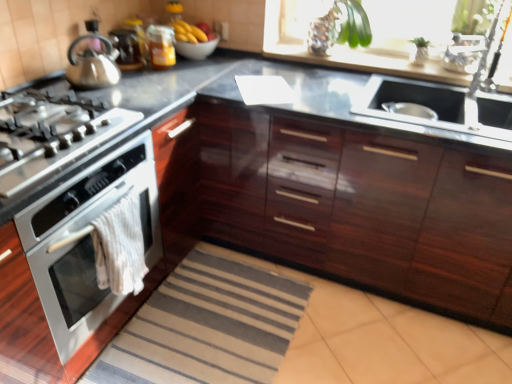
Based on the photo, in order to face satin steel sink at center right, should I rotate leftwards or rightwards?

To face it directly, rotate right by 23.211 degrees.

What do you see at coordinates (126, 49) in the screenshot? I see `metallic silver kettle at upper left` at bounding box center [126, 49].

In order to face satin nickel faucet at upper right, should I rotate leftwards or rightwards?

To align with it, rotate right about 27.748°.

This screenshot has height=384, width=512. I want to click on yellow matte bananas at upper center, so click(x=188, y=32).

Locate an element on the screen. This screenshot has height=384, width=512. satin steel sink at center right is located at coordinates (438, 107).

I want to click on material lying below the shiny metallic kettle at upper left (from the image's perspective), so click(120, 247).

Is white towel at lower left oriented towards shiny metallic kettle at upper left?

No, white towel at lower left is not oriented towards shiny metallic kettle at upper left.

From the image's perspective, is white towel at lower left positioned above or below shiny metallic kettle at upper left?

From the image's perspective, white towel at lower left appears below shiny metallic kettle at upper left.

Does white towel at lower left appear on the right side of shiny metallic kettle at upper left?

Yes, white towel at lower left is to the right of shiny metallic kettle at upper left.

How different are the orientations of satin steel sink at center right and shiny metallic kettle at upper left in degrees?

68.8 degrees.

Looking at this image, from the image's perspective, who appears lower, satin steel sink at center right or shiny metallic kettle at upper left?

satin steel sink at center right appears lower in the image.

Is the surface of satin steel sink at center right in direct contact with shiny metallic kettle at upper left?

No, satin steel sink at center right is not in contact with shiny metallic kettle at upper left.

In the scene shown: Is shiny metallic kettle at upper left inside satin steel sink at center right?

No, shiny metallic kettle at upper left is located outside of satin steel sink at center right.

Choose the correct answer: Is white towel at lower left inside satin silver gas stove at left or outside it?

white towel at lower left is spatially situated outside satin silver gas stove at left.

Is white towel at lower left placed right next to satin silver gas stove at left?

No, white towel at lower left is not beside satin silver gas stove at left.

Considering the relative sizes of white towel at lower left and satin silver gas stove at left in the image provided, is white towel at lower left smaller than satin silver gas stove at left?

Indeed, white towel at lower left has a smaller size compared to satin silver gas stove at left.

In the image, is satin silver gas stove at left on the left side or the right side of shiny metallic kettle at upper left?

In the image, satin silver gas stove at left appears on the left side of shiny metallic kettle at upper left.

Is satin silver gas stove at left turned away from shiny metallic kettle at upper left?

No, satin silver gas stove at left's orientation is not away from shiny metallic kettle at upper left.

From the image's perspective, which is above, satin silver gas stove at left or shiny metallic kettle at upper left?

shiny metallic kettle at upper left appears higher in the image.

Can you tell me how much satin silver gas stove at left and shiny metallic kettle at upper left differ in facing direction?

There is a 21.2-degree angle between the facing directions of satin silver gas stove at left and shiny metallic kettle at upper left.

From a real-world perspective, is shiny metallic kettle at upper left above or below metallic silver kettle at upper left?

shiny metallic kettle at upper left is above metallic silver kettle at upper left.

Can you tell me how much shiny metallic kettle at upper left and metallic silver kettle at upper left differ in facing direction?

The angular difference between shiny metallic kettle at upper left and metallic silver kettle at upper left is 28.7 degrees.

Where is `kitchen appliance located in front of the metallic silver kettle at upper left`? kitchen appliance located in front of the metallic silver kettle at upper left is located at coordinates (92, 65).

Could you tell me if yellow matte bananas at upper center is facing shiny metallic kettle at upper left?

No, yellow matte bananas at upper center is not aimed at shiny metallic kettle at upper left.

Consider the image. Which is more to the left, yellow matte bananas at upper center or shiny metallic kettle at upper left?

shiny metallic kettle at upper left.

Considering the relative positions of yellow matte bananas at upper center and shiny metallic kettle at upper left in the image provided, is yellow matte bananas at upper center in front of shiny metallic kettle at upper left?

No, yellow matte bananas at upper center is further to the viewer.

Where is `fruit to the right of shiny metallic kettle at upper left`? This screenshot has height=384, width=512. fruit to the right of shiny metallic kettle at upper left is located at coordinates (188, 32).

Can you confirm if glossy wood cabinetry at center is wider than shiny metallic kettle at upper left?

Correct, the width of glossy wood cabinetry at center exceeds that of shiny metallic kettle at upper left.

Is there a large distance between glossy wood cabinetry at center and shiny metallic kettle at upper left?

glossy wood cabinetry at center is near shiny metallic kettle at upper left, not far away.

From the image's perspective, which is below, glossy wood cabinetry at center or shiny metallic kettle at upper left?

glossy wood cabinetry at center.

Can you confirm if glossy wood cabinetry at center is taller than shiny metallic kettle at upper left?

Yes.

Find the location of a particular element. This screenshot has height=384, width=512. kitchen appliance located above the white towel at lower left (from a real-world perspective) is located at coordinates (92, 65).

Locate an element on the screen. kitchen appliance on the left of the satin steel sink at center right is located at coordinates (92, 65).

Based on their spatial positions, is yellow matte bananas at upper center or metallic silver kettle at upper left further from satin steel sink at center right?

The object further to satin steel sink at center right is metallic silver kettle at upper left.

Based on their spatial positions, is yellow matte bananas at upper center or glossy wood cabinetry at center further from satin nickel faucet at upper right?

yellow matte bananas at upper center lies further to satin nickel faucet at upper right than the other object.

From the image, which object appears to be farther from glossy wood cabinetry at center, satin silver gas stove at left or shiny metallic kettle at upper left?

The object further to glossy wood cabinetry at center is shiny metallic kettle at upper left.

Estimate the real-world distances between objects in this image. Which object is further from satin steel sink at center right, satin silver gas stove at left or white towel at lower left?

Among the two, satin silver gas stove at left is located further to satin steel sink at center right.

Based on their spatial positions, is glossy wood cabinetry at center or satin silver gas stove at left further from satin steel sink at center right?

Among the two, satin silver gas stove at left is located further to satin steel sink at center right.

Which object lies nearer to the anchor point satin steel sink at center right, metallic silver kettle at upper left or yellow matte bananas at upper center?

yellow matte bananas at upper center lies closer to satin steel sink at center right than the other object.

Looking at the image, which one is located closer to metallic silver kettle at upper left, satin nickel faucet at upper right or yellow matte bananas at upper center?

Among the two, yellow matte bananas at upper center is located nearer to metallic silver kettle at upper left.

Estimate the real-world distances between objects in this image. Which object is closer to white towel at lower left, metallic silver kettle at upper left or satin nickel faucet at upper right?

metallic silver kettle at upper left is closer to white towel at lower left.

What are the coordinates of `sink located between metallic silver kettle at upper left and satin nickel faucet at upper right in the left-right direction` in the screenshot? It's located at (438, 107).

The height and width of the screenshot is (384, 512). Identify the location of cabinetry between yellow matte bananas at upper center and satin nickel faucet at upper right. click(x=362, y=207).

You are a GUI agent. You are given a task and a screenshot of the screen. Output one action in this format:
    pyautogui.click(x=<x>, y=<y>)
    Task: Click on the kitchen appliance that lies between yellow matte bananas at upper center and white towel at lower left from top to bottom
    Image resolution: width=512 pixels, height=384 pixels.
    Given the screenshot: What is the action you would take?
    pyautogui.click(x=92, y=65)

This screenshot has width=512, height=384. In order to click on fruit between satin silver gas stove at left and glossy wood cabinetry at center in the horizontal direction in this screenshot , I will do `click(188, 32)`.